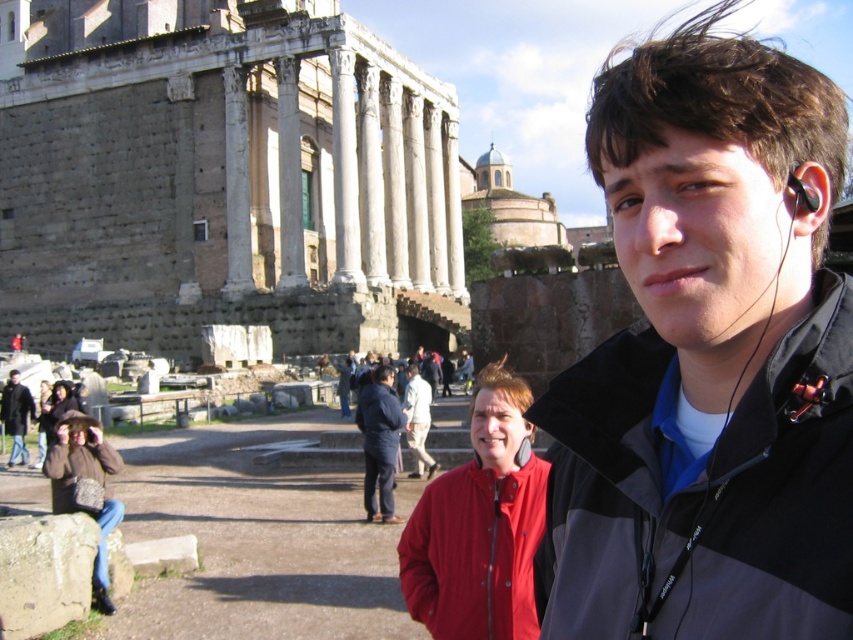
Is dark blue jacket at center to the right of black matte earphone at upper right from the viewer's perspective?

In fact, dark blue jacket at center is to the left of black matte earphone at upper right.

Can you confirm if dark blue jacket at center is positioned to the left of black matte earphone at upper right?

Yes, dark blue jacket at center is to the left of black matte earphone at upper right.

Which is in front, point (357, 417) or point (811, 196)?

Point (811, 196)

Where is `dark blue jacket at center`? dark blue jacket at center is located at coordinates 379,442.

Between point (604, 477) and point (415, 372), which one is positioned in front?

Point (604, 477) is in front.

From the picture: Is dark gray nylon jacket at right to the right of light beige fabric jacket at center from the viewer's perspective?

Correct, you'll find dark gray nylon jacket at right to the right of light beige fabric jacket at center.

This screenshot has height=640, width=853. Describe the element at coordinates (701, 493) in the screenshot. I see `dark gray nylon jacket at right` at that location.

The height and width of the screenshot is (640, 853). I want to click on dark gray nylon jacket at right, so click(701, 493).

Who is shorter, brown textured jacket at lower left or dark brown leather jacket at lower left?

With less height is dark brown leather jacket at lower left.

Is point (49, 451) positioned before point (4, 396)?

That is True.

At what (x,y) coordinates should I click in order to perform the action: click on brown textured jacket at lower left. Please return your answer as a coordinate pair (x, y). Looking at the image, I should click on (77, 465).